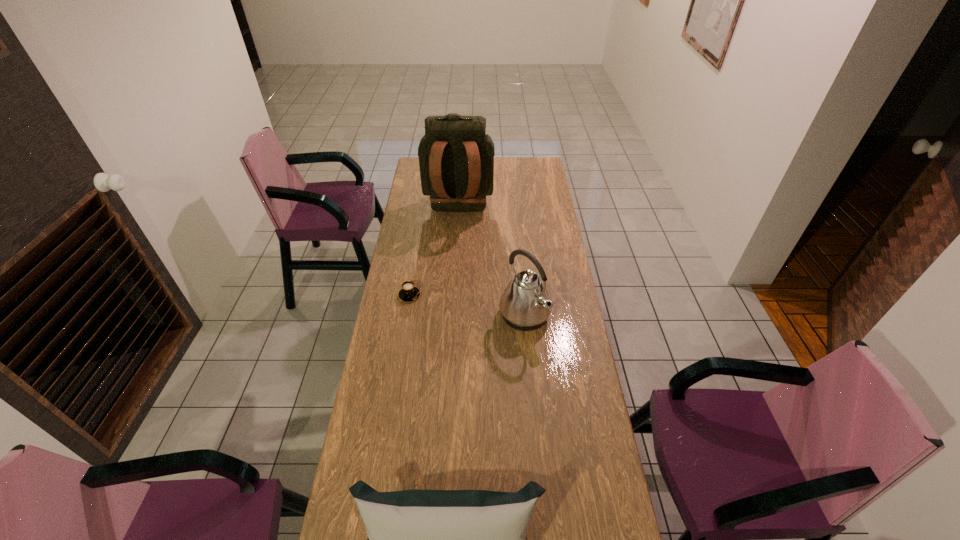
Where is `vacant space that satisfies the following two spatial constraints: 1. on the back of the kettle; 2. on the left side of the farthest object`? The width and height of the screenshot is (960, 540). vacant space that satisfies the following two spatial constraints: 1. on the back of the kettle; 2. on the left side of the farthest object is located at coordinates (452, 316).